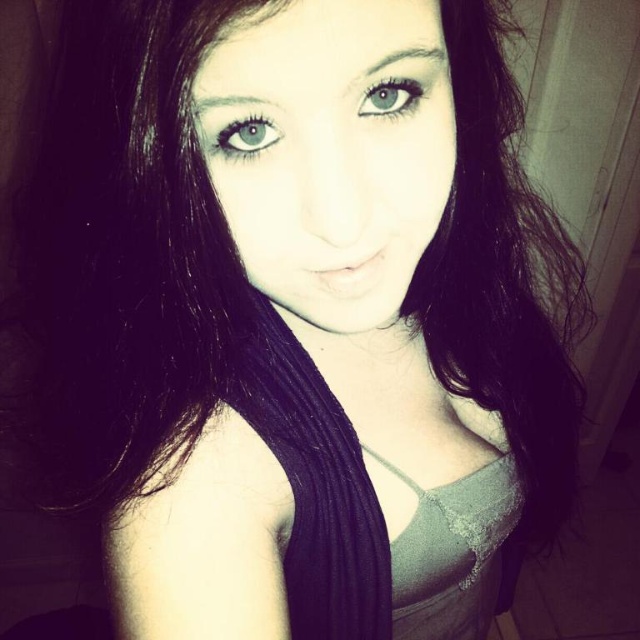
Is gray lace dress at center in front of blue matte eye at upper center?

No.

Does gray lace dress at center have a lesser height compared to blue matte eye at upper center?

No.

Where is `gray lace dress at center`? The width and height of the screenshot is (640, 640). gray lace dress at center is located at coordinates (452, 552).

Find the location of a particular element. gray lace dress at center is located at coordinates (452, 552).

Can you confirm if green matte eye at upper center is taller than blue matte eye at upper center?

Incorrect, green matte eye at upper center's height is not larger of blue matte eye at upper center's.

Between green matte eye at upper center and blue matte eye at upper center, which one appears on the left side from the viewer's perspective?

Positioned to the left is green matte eye at upper center.

Who is more distant from viewer, (x=260, y=140) or (x=392, y=113)?

Positioned behind is point (x=392, y=113).

Where is `green matte eye at upper center`? This screenshot has width=640, height=640. green matte eye at upper center is located at coordinates (246, 134).

Does gray lace dress at center have a larger size compared to green matte eye at upper center?

Yes.

What do you see at coordinates (452, 552) in the screenshot?
I see `gray lace dress at center` at bounding box center [452, 552].

Image resolution: width=640 pixels, height=640 pixels. I want to click on gray lace dress at center, so click(452, 552).